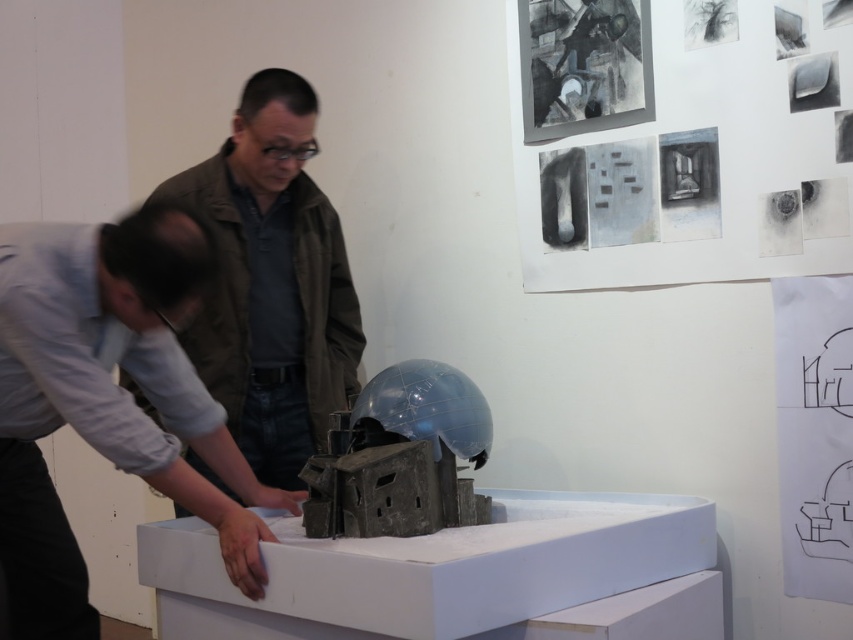
You are a security camera monitoring the exhibition hall. There is a restricted area marked between the light gray shirt at lower left and the matte brown jacket at center. If the restricted area is only 1.2 meters wide, can both individuals stay in their current positions without violating the space?

The light gray shirt at lower left might be wider than matte brown jacket at center, but since the restricted area is 1.2 meters wide, it is uncertain if their combined width exceeds this limit. Further measurement is needed to confirm compliance.

You are an architect visiting an exhibition and want to approach the model on the pedestal. You are currently standing behind the light gray shirt at lower left and the matte brown jacket at center. Which person are you closer to?

You are closer to the light gray shirt at lower left because it is positioned below the matte brown jacket at center, indicating it is closer to your current position.

You are standing in front of the model and want to move to the right side of the matte brown jacket at center. Which direction should you move relative to the light gray shirt at lower left?

To reach the right side of the matte brown jacket at center, you should move to the right relative to the light gray shirt at lower left since the light gray shirt at lower left is positioned to the left of the matte brown jacket at center.